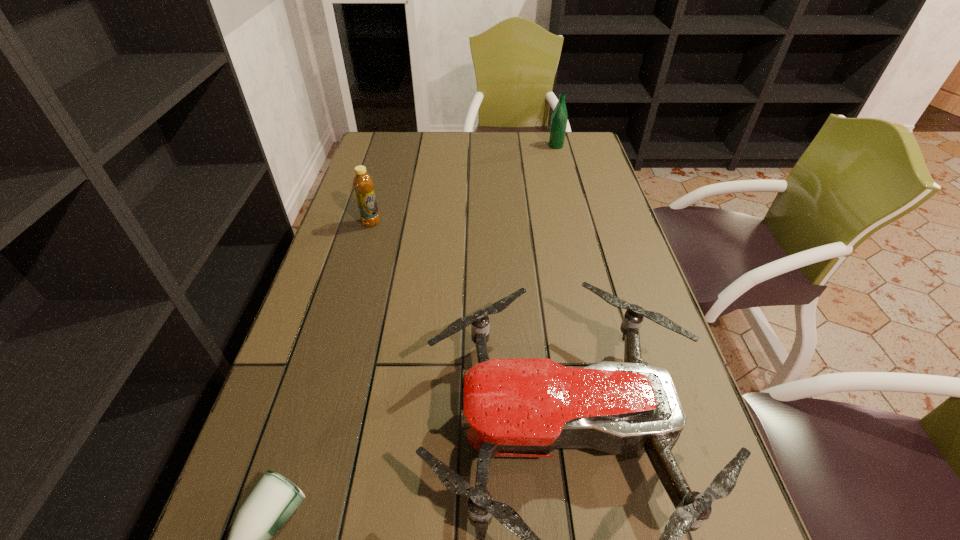
Locate which bottle is the second closest to the second farthest object. Please provide its 2D coordinates. Your answer should be formatted as a tuple, i.e. [(x, y)], where the tuple contains the x and y coordinates of a point satisfying the conditions above.

[(274, 499)]